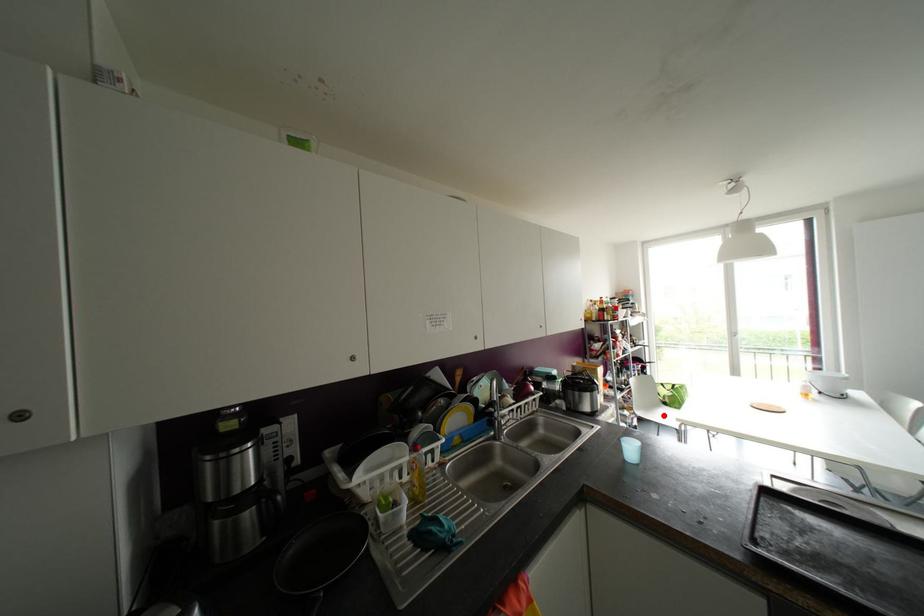
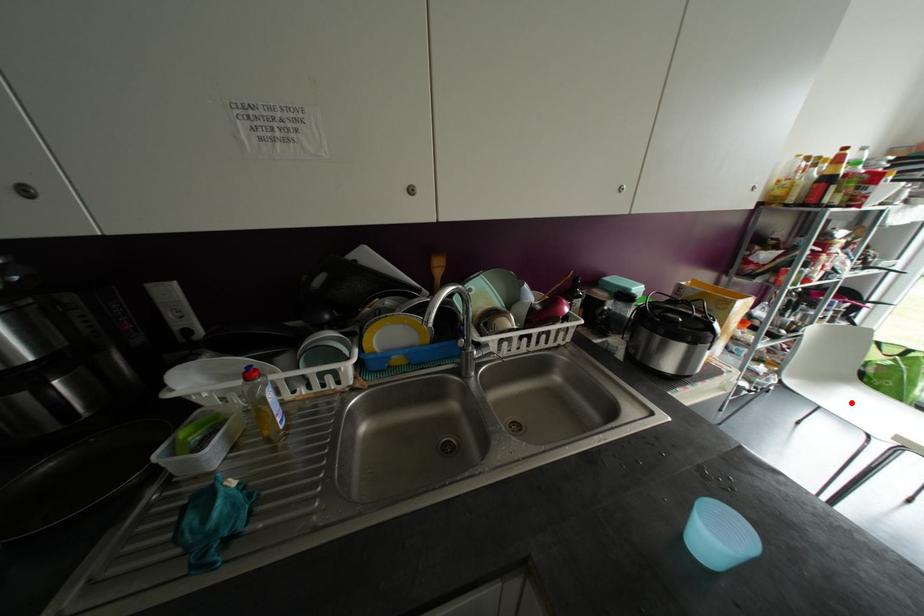
I am providing you with two images of the same scene from different viewpoints. A red point is marked on the first image and another point is marked on the second image. Is the red point in image1 aligned with the point shown in image2?

Yes